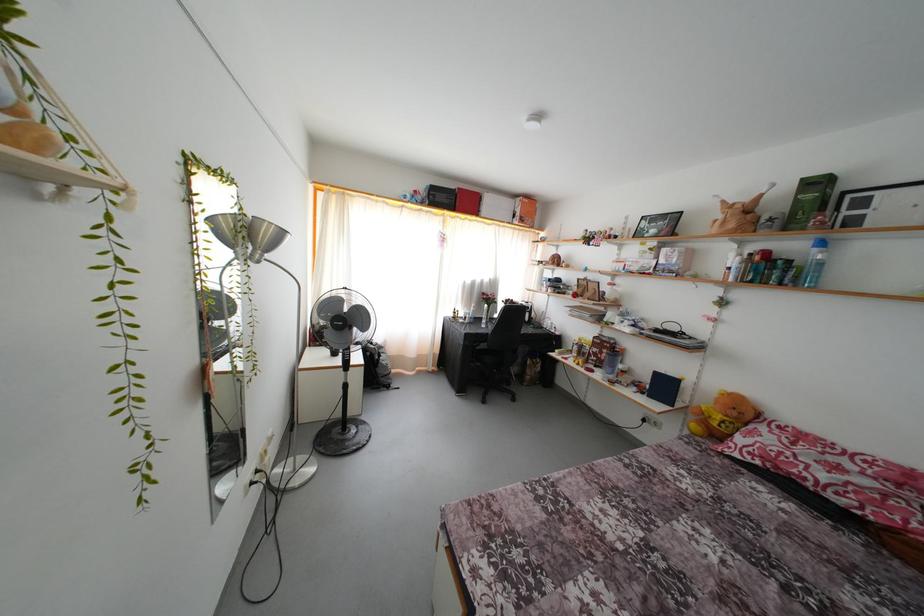
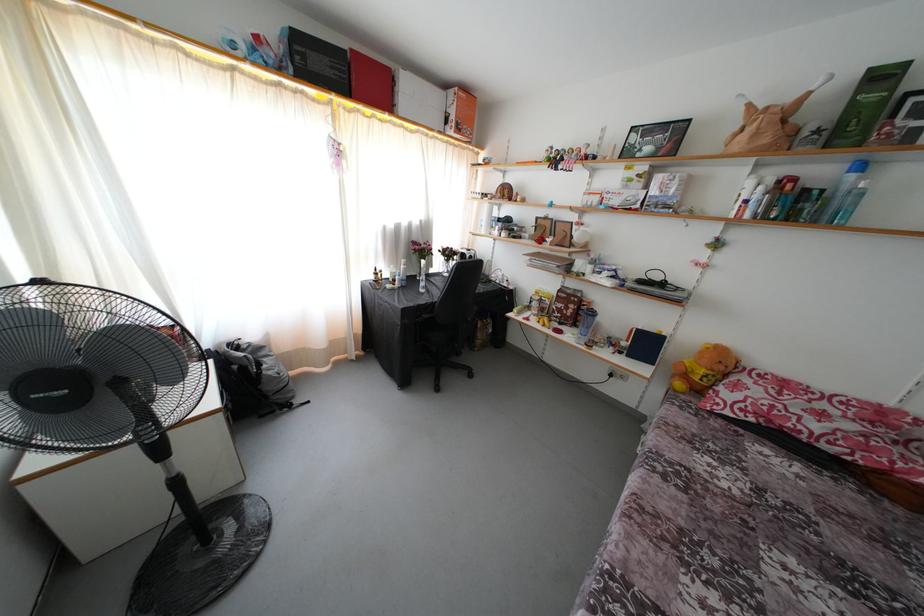
Where in the second image is the point corresponding to [445,204] from the first image?

(322, 69)